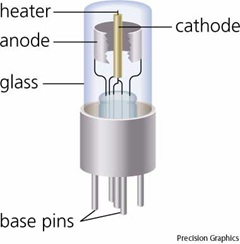
Where is `heater`? Image resolution: width=240 pixels, height=244 pixels. heater is located at coordinates (117, 12).